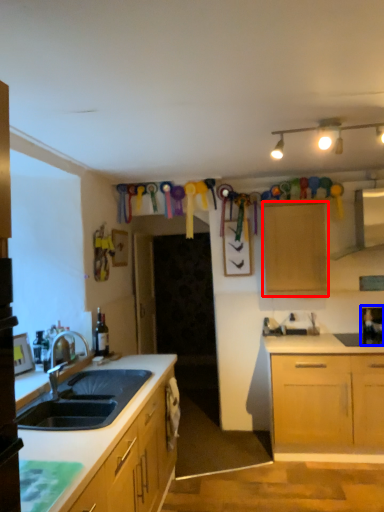
Question: Which object is further to the camera taking this photo, cabinetry (highlighted by a red box) or appliance (highlighted by a blue box)?

Choices:
 (A) cabinetry
 (B) appliance

Answer: (B)